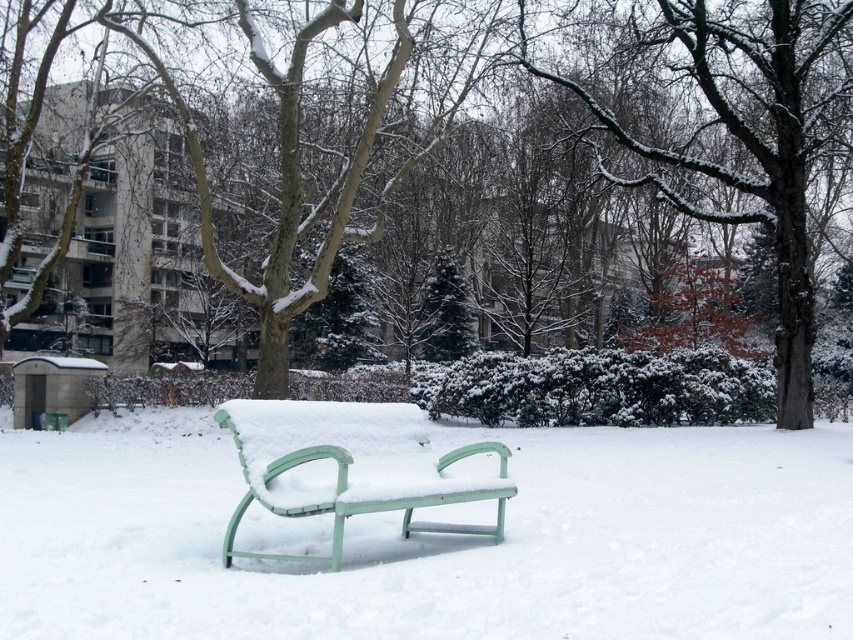
Does white matte bench at center have a larger size compared to green plastic bench at center?

Yes, white matte bench at center is bigger than green plastic bench at center.

Does point (164, 435) lie behind point (390, 500)?

Yes.

Does point (143, 632) come in front of point (349, 474)?

Yes, point (143, 632) is in front of point (349, 474).

At what (x,y) coordinates should I click in order to perform the action: click on white matte bench at center. Please return your answer as a coordinate pair (x, y). Image resolution: width=853 pixels, height=640 pixels. Looking at the image, I should click on (434, 538).

Does point (258, 289) come behind point (328, 492)?

Yes.

Does point (729, 160) come closer to viewer compared to point (346, 476)?

No, (729, 160) is behind (346, 476).

Identify the location of snow-covered tree at center. (457, 161).

Does point (584, 193) lie in front of point (21, 554)?

No, (584, 193) is behind (21, 554).

Is snow-covered tree at center shorter than white matte bench at center?

No.

Looking at this image, measure the distance between point (x=155, y=284) and camera.

Point (x=155, y=284) is 36.11 meters away from camera.

What are the coordinates of `snow-covered tree at center` in the screenshot? It's located at (457, 161).